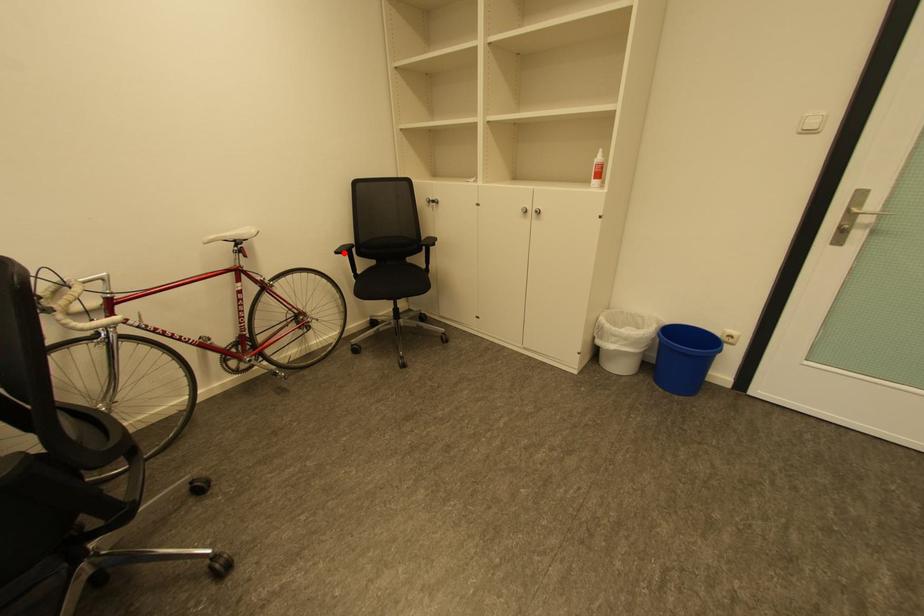
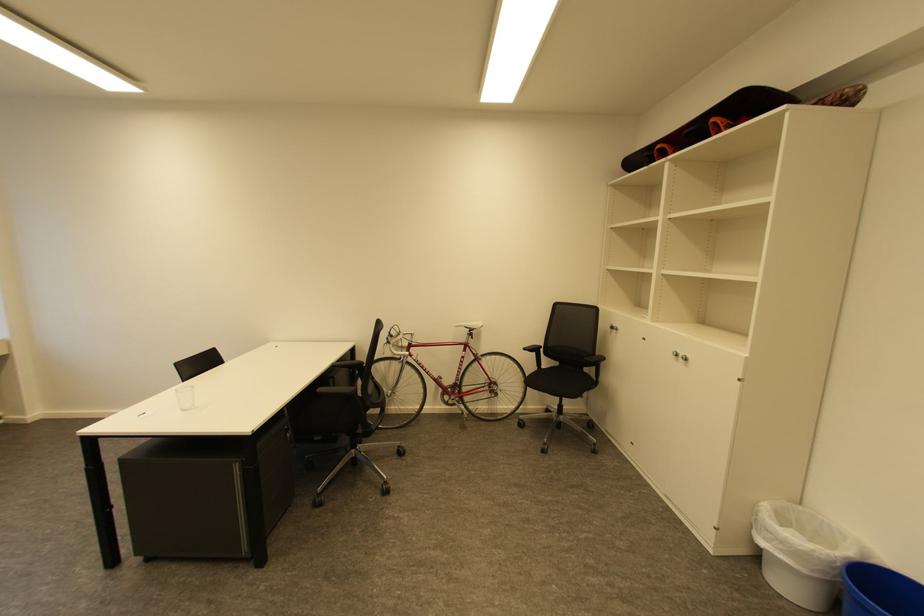
Question: I am providing you with two images of the same scene from different viewpoints. Given a red point in image1, look at the same physical point in image2. Is it:

Choices:
 (A) Closer to the viewpoint
 (B) Farther from the viewpoint

Answer: (B)